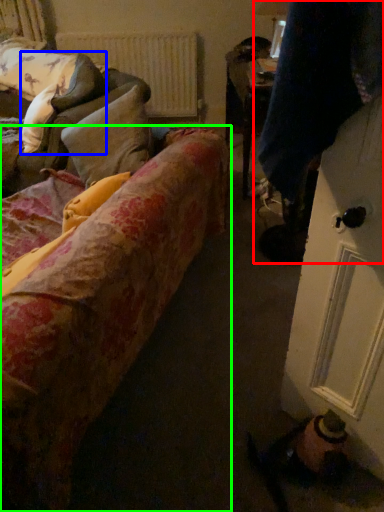
Question: Based on their relative distances, which object is nearer to couple (highlighted by a red box)? Choose from pillow (highlighted by a blue box) and studio couch (highlighted by a green box).

Choices:
 (A) pillow
 (B) studio couch

Answer: (B)